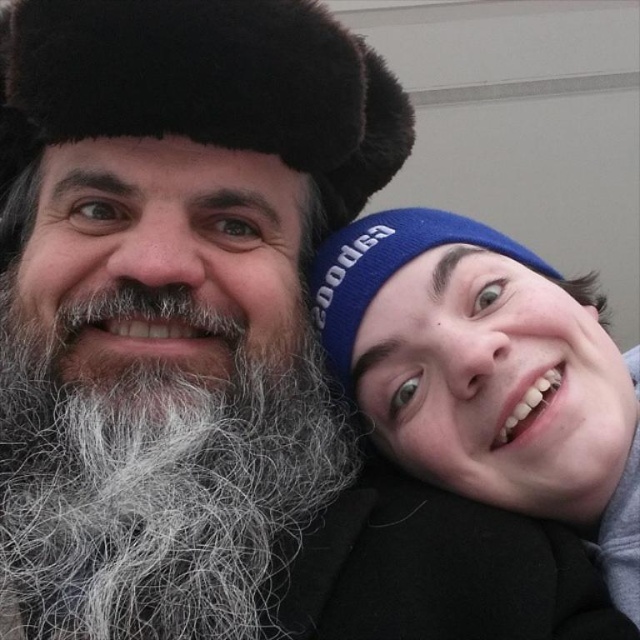
You are taking a photo of two people in the scene. You want to focus on the person closer to the camera. Which point should you focus on, point (241, 84) or point (348, 292)?

Point (241, 84) is closer to the viewer than point (348, 292), so you should focus on point (241, 84) to capture the person closer to the camera.

You are a photographer trying to capture a clear photo of both the blue knit cap at upper right and the fuzzy fur hat at upper left in the same frame. Which cap should you focus on first to ensure both are in focus?

The blue knit cap at upper right has a larger size compared to fuzzy fur hat at upper left, so you should focus on the blue knit cap at upper right first to ensure both are in focus.

You are taking a photo of two people wearing hats. The blue knit cap at upper right and the fuzzy fur hat at upper left are in the frame. Which hat is positioned closer to the camera?

The blue knit cap at upper right is closer to the viewer than the fuzzy fur hat at upper left, so the blue knit cap at upper right is positioned closer to the camera.